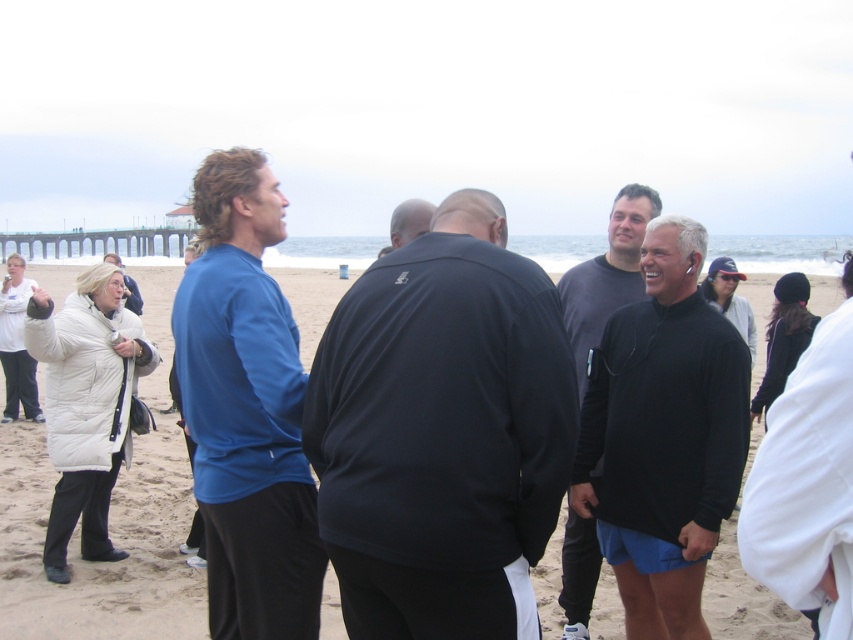
Question: Does matte black jacket at center appear on the right side of sandy beach at center?

Choices:
 (A) no
 (B) yes

Answer: (B)

Question: Among these points, which one is nearest to the camera?

Choices:
 (A) (158, 340)
 (B) (120, 268)
 (C) (202, 513)

Answer: (C)

Question: Which point is closer to the camera?

Choices:
 (A) (506, 388)
 (B) (590, 540)
 (C) (117, 262)

Answer: (A)

Question: Among these objects, which one is farthest from the camera?

Choices:
 (A) black matte shirt at right
 (B) white matte jacket at upper left
 (C) dark gray sweater at center

Answer: (B)

Question: Can you confirm if blue fleece jacket at center is wider than dark gray sweater at center?

Choices:
 (A) no
 (B) yes

Answer: (B)

Question: Does matte black jacket at center appear on the right side of white matte jacket at upper left?

Choices:
 (A) yes
 (B) no

Answer: (A)